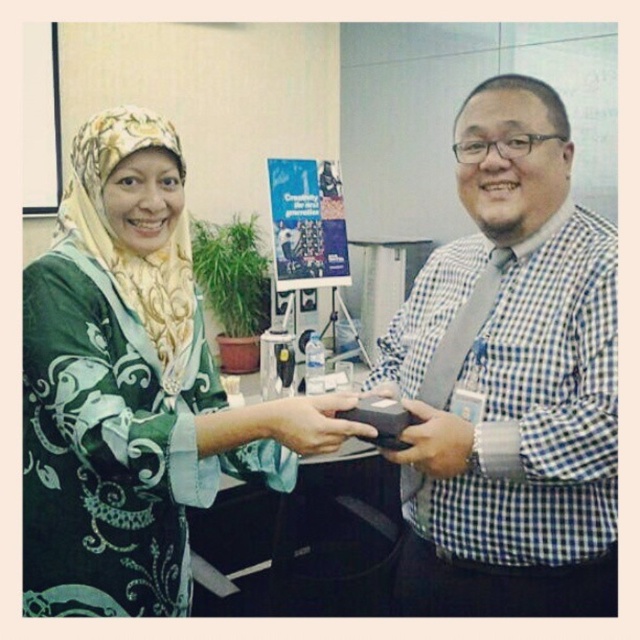
From the picture: You are an event planner organizing a gift exchange. You need to ensure the gift is placed correctly between the blue checkered shirt at center and the matte black box at center. According to the scene, which object is on the left side so you can position the gift appropriately?

The matte black box at center is on the left side of the blue checkered shirt at center, so you should position the gift next to the matte black box at center to align with their current arrangement.

In the scene shown: You are an event planner organizing a photo shoot and need to place a 10 cm wide ribbon between the blue checkered shirt at center and the green printed dress at center. Can the ribbon fit horizontally between them?

The blue checkered shirt at center is thinner than the green printed dress at center. The difference in their widths may allow the ribbon to fit, but without exact measurements, it is uncertain. However, since the shirt is thinner, there might be enough space between them for the 10 cm ribbon to fit horizontally.

You are a delivery robot that needs to deliver a package to the blue checkered shirt at center. The package is currently placed on the matte black box at center. The delivery robot has a maximum reach of 6 inches. Can the robot reach the package from its current position?

The blue checkered shirt at center is 7.02 inches away from the matte black box at center. Since the robot can only reach up to 6 inches, it cannot reach the package from its current position.